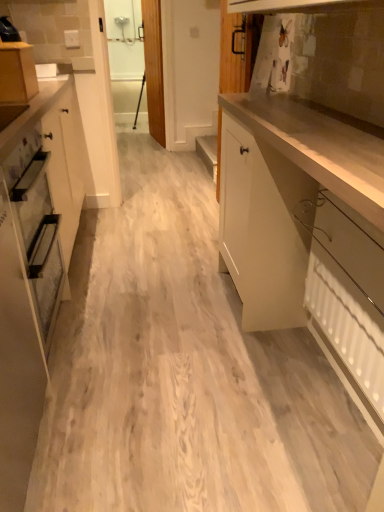
Identify the location of free spot below white glossy cabinet at left, the 2th cabinetry when ordered from left to right (from a real-world perspective). This screenshot has height=512, width=384. (40, 454).